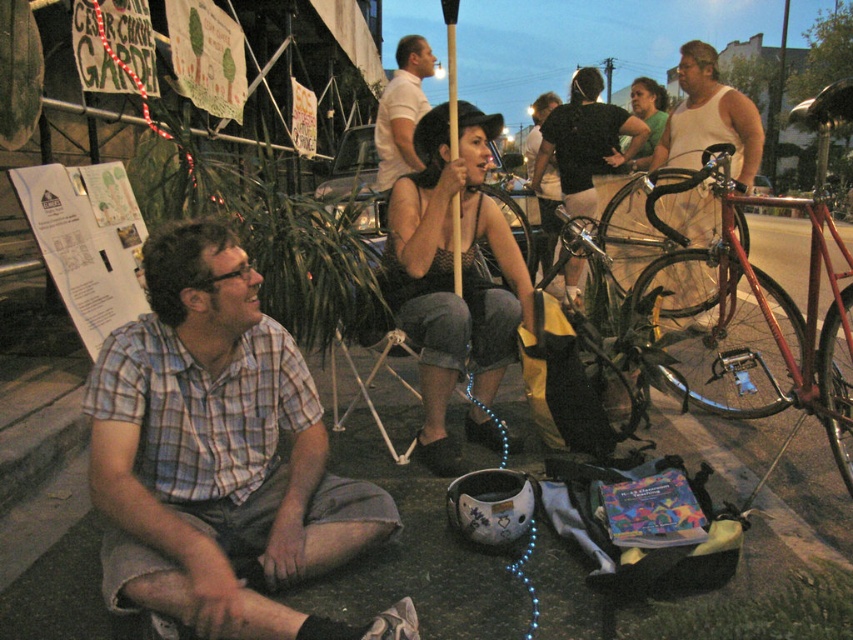
Does shiny red bicycle at right have a smaller size compared to black tank top at center?

No, shiny red bicycle at right is not smaller than black tank top at center.

Does shiny red bicycle at right have a lesser height compared to black tank top at center?

No.

Does point (735, 307) come in front of point (619, 113)?

No, it is not.

Identify the location of shiny red bicycle at right. (747, 320).

Which is above, shiny red bicycle at right or smooth white tank top at center?

Positioned higher is smooth white tank top at center.

Is point (840, 419) more distant than point (544, 179)?

No.

Identify the location of shiny red bicycle at right. Image resolution: width=853 pixels, height=640 pixels. (747, 320).

Between point (515, 314) and point (607, 113), which one is positioned in front?

Positioned in front is point (515, 314).

Is the position of matte black tank top at center less distant than that of black tank top at center?

Yes, it is in front of black tank top at center.

Does point (500, 221) come in front of point (534, 180)?

Yes, it is.

I want to click on matte black tank top at center, so click(x=451, y=273).